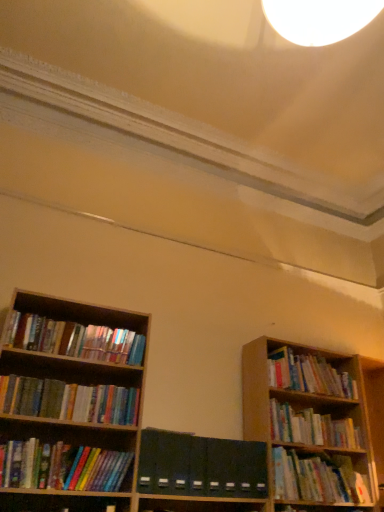
Question: Choose the correct answer: Is hardcover books at lower right, which appears as the 4th book when viewed from the left, inside dark green matte folder at center or outside it?

Choices:
 (A) outside
 (B) inside

Answer: (A)

Question: Is hardcover books at lower right, the third book positioned from the right, wider or thinner than dark green matte folder at center?

Choices:
 (A) wide
 (B) thin

Answer: (A)

Question: Considering the real-world distances, which object is closest to the hardcover books at lower right, which appears as the 4th book when viewed from the left?

Choices:
 (A) wooden bookshelf at right, which is the 6th book in left-to-right order
 (B) dark green matte folder at center
 (C) hardcover books at right, which is the 5th book in left-to-right order
 (D) hardcover books at left, which ranks as the fifth book in right-to-left order
 (E) multicolored paperbacks at left, acting as the first book starting from the left

Answer: (C)

Question: Estimate the real-world distances between objects in this image. Which object is closer to the dark green matte folder at center?

Choices:
 (A) hardcover books at left, the second book viewed from the left
 (B) hardcover books at lower left, the fourth book in the right-to-left sequence
 (C) hardcover books at lower right, the third book positioned from the right
 (D) hardcover books at right, the 2th book positioned from the right
 (E) multicolored paperbacks at left, which is the 6th book in right-to-left order

Answer: (C)